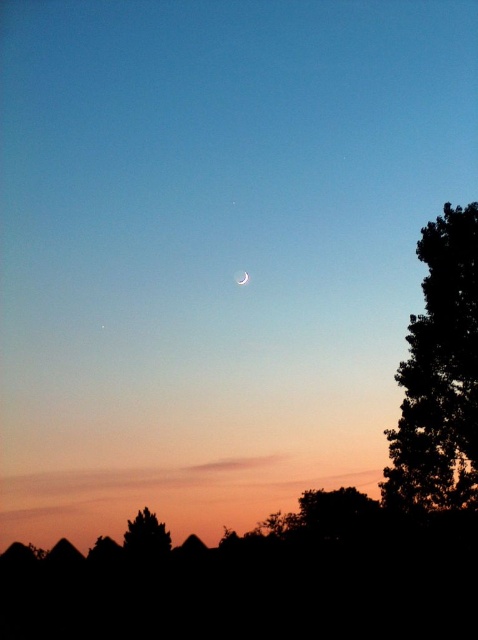
Is silhouette tree at right positioned before silhouette tree at lower left?

Yes.

Can you confirm if silhouette tree at right is wider than silhouette tree at lower left?

Correct, the width of silhouette tree at right exceeds that of silhouette tree at lower left.

The width and height of the screenshot is (478, 640). I want to click on silhouette tree at right, so click(x=440, y=374).

Find the location of a particular element. This screenshot has height=640, width=478. silhouette tree at right is located at coordinates (440, 374).

Consider the image. Can you confirm if silhouette tree at right is positioned below white glossy moon at center?

Indeed, silhouette tree at right is positioned under white glossy moon at center.

This screenshot has height=640, width=478. Identify the location of silhouette tree at right. (440, 374).

Is silhouette tree at lower left bigger than white glossy moon at center?

Indeed, silhouette tree at lower left has a larger size compared to white glossy moon at center.

Does point (156, 550) come closer to viewer compared to point (240, 269)?

That is True.

At what (x,y) coordinates should I click in order to perform the action: click on silhouette tree at lower left. Please return your answer as a coordinate pair (x, y). This screenshot has width=478, height=640. Looking at the image, I should click on (147, 536).